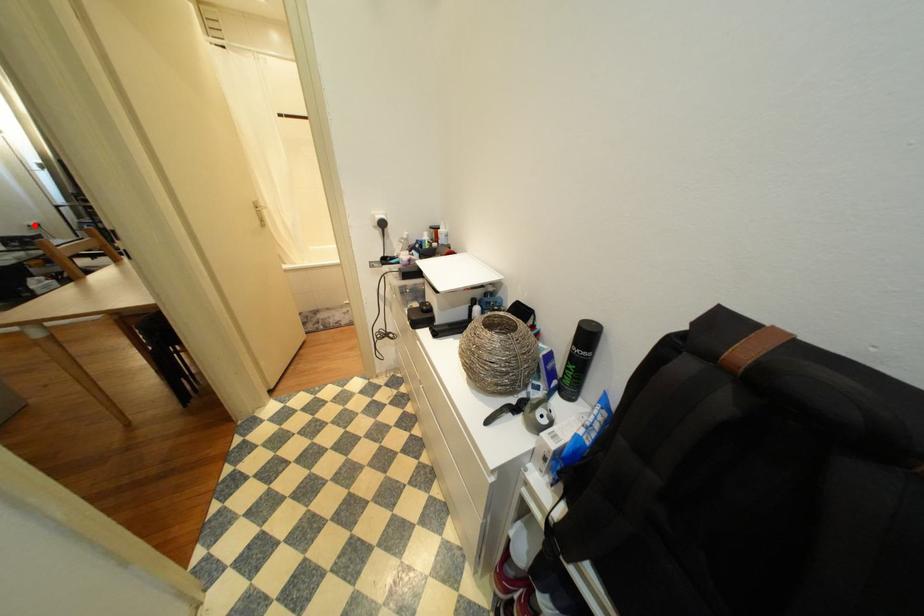
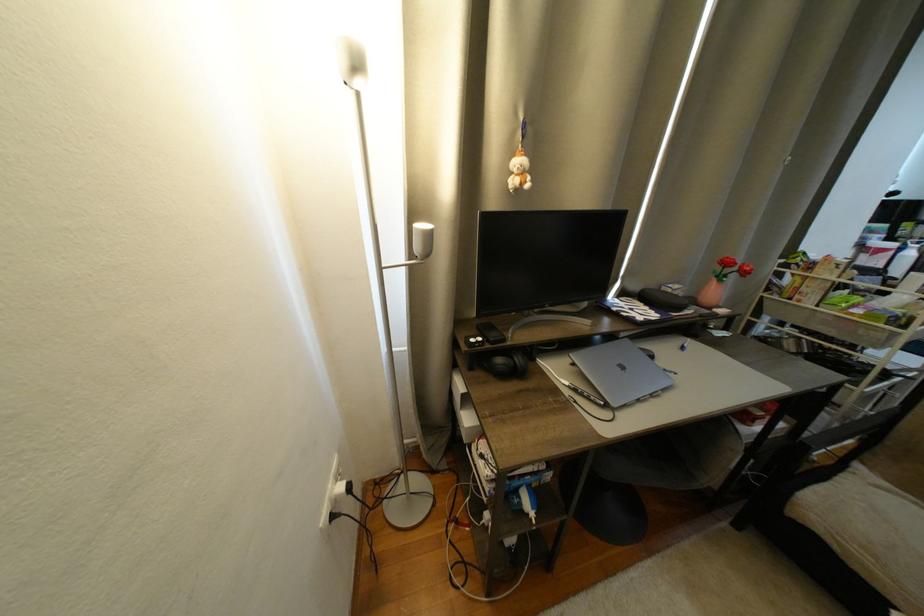
In the second image, find the point that corresponds to the highlighted location in the first image.

(333, 520)